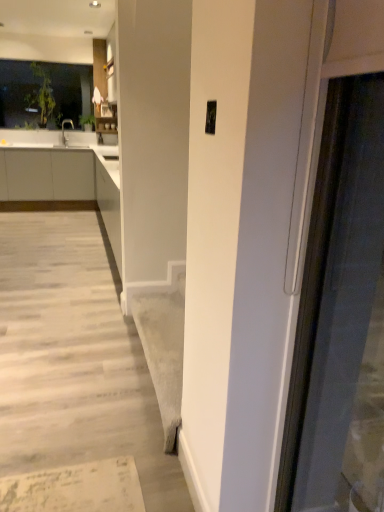
Question: Is white matte cabinetry at left at the left side of matte silver faucet at upper left?

Choices:
 (A) no
 (B) yes

Answer: (B)

Question: Is white matte cabinetry at left in contact with matte silver faucet at upper left?

Choices:
 (A) no
 (B) yes

Answer: (A)

Question: Can you confirm if white matte cabinetry at left is shorter than matte silver faucet at upper left?

Choices:
 (A) no
 (B) yes

Answer: (A)

Question: Would you say white matte cabinetry at left is outside matte silver faucet at upper left?

Choices:
 (A) no
 (B) yes

Answer: (B)

Question: From the image's perspective, is white matte cabinetry at left below matte silver faucet at upper left?

Choices:
 (A) no
 (B) yes

Answer: (B)

Question: Can you confirm if white matte cabinetry at left is wider than matte silver faucet at upper left?

Choices:
 (A) yes
 (B) no

Answer: (A)

Question: From the image's perspective, is transparent glass window at upper left beneath matte silver faucet at upper left?

Choices:
 (A) no
 (B) yes

Answer: (A)

Question: From a real-world perspective, is transparent glass window at upper left under matte silver faucet at upper left?

Choices:
 (A) no
 (B) yes

Answer: (A)

Question: Does transparent glass window at upper left contain matte silver faucet at upper left?

Choices:
 (A) yes
 (B) no

Answer: (B)

Question: Is transparent glass window at upper left positioned far away from matte silver faucet at upper left?

Choices:
 (A) no
 (B) yes

Answer: (A)

Question: Considering the relative positions of transparent glass window at upper left and matte silver faucet at upper left in the image provided, is transparent glass window at upper left to the right of matte silver faucet at upper left from the viewer's perspective?

Choices:
 (A) yes
 (B) no

Answer: (B)

Question: Is the depth of transparent glass window at upper left less than that of matte silver faucet at upper left?

Choices:
 (A) no
 (B) yes

Answer: (B)

Question: Are transparent glass window at upper left and white matte cabinetry at left far apart?

Choices:
 (A) no
 (B) yes

Answer: (B)